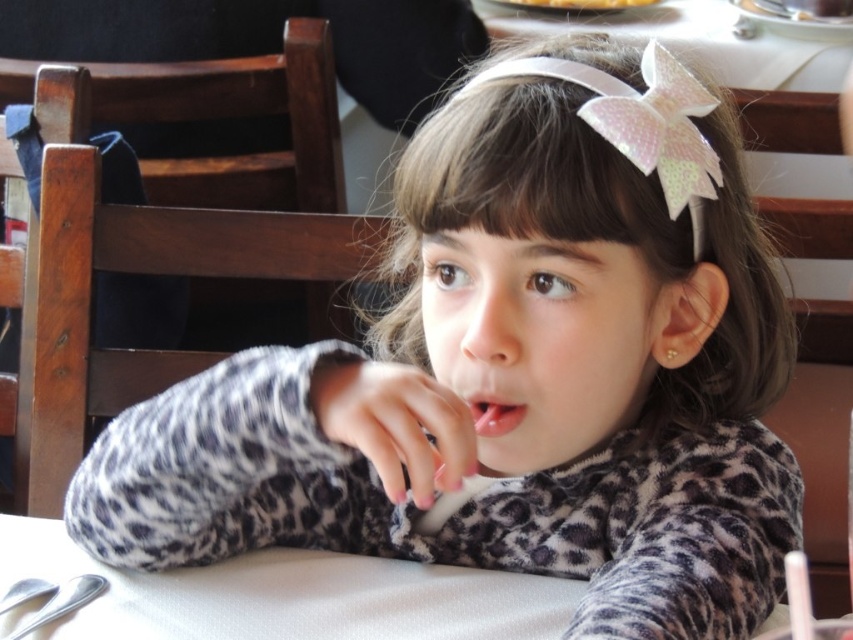
You are a photographer adjusting your camera to focus on two points in the image. The first point is point (218, 580) and the second point is point (521, 406). Which point should you focus on first if you want to capture the closest object to the camera?

Point (218, 580) is further to the camera than point (521, 406), so you should focus on point (218, 580) first to capture the closest object to the camera.

You are a photographer trying to capture a closeup of the girl while ensuring the white matte table at center remains visible in the frame. Given that the pink glossy lips at center are smaller than the table, how should you adjust your camera angle to include both objects?

Since the white matte table at center is bigger than the pink glossy lips at center, you can zoom out slightly to ensure both the larger table and the smaller lips are visible in the frame while maintaining the focus on the girl.